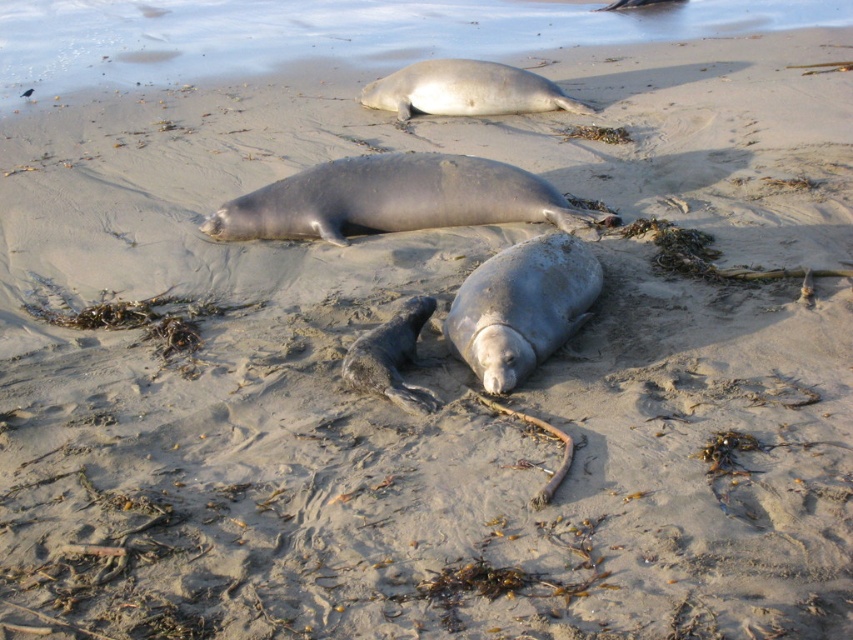
Does smooth gray seal at center have a smaller size compared to gray matte seal at upper center?

Indeed, smooth gray seal at center has a smaller size compared to gray matte seal at upper center.

Who is positioned more to the right, smooth gray seal at center or gray matte seal at upper center?

gray matte seal at upper center is more to the right.

Identify the location of smooth gray seal at center. (397, 198).

Can you confirm if smooth gray seal at center is positioned to the left of gray matte seal at center?

Correct, you'll find smooth gray seal at center to the left of gray matte seal at center.

Who is lower down, smooth gray seal at center or gray matte seal at center?

gray matte seal at center is lower down.

Where is `smooth gray seal at center`? The width and height of the screenshot is (853, 640). smooth gray seal at center is located at coordinates (397, 198).

Is gray matte seal at center to the right of gray matte seal at upper center from the viewer's perspective?

Yes, gray matte seal at center is to the right of gray matte seal at upper center.

Identify the location of gray matte seal at center. (521, 307).

Which is in front, point (523, 292) or point (397, 81)?

Point (523, 292) is more forward.

Where is `gray matte seal at center`? This screenshot has height=640, width=853. gray matte seal at center is located at coordinates (521, 307).